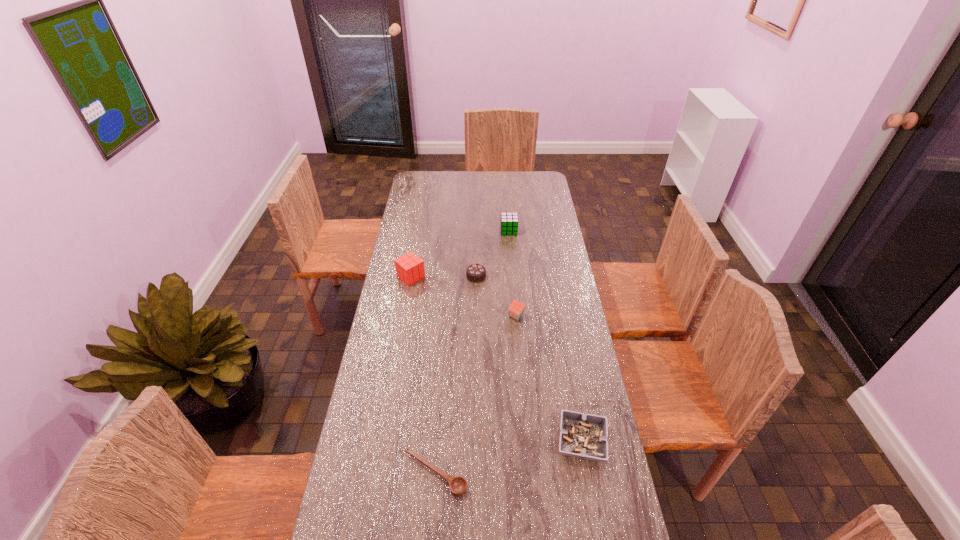
In the image, there is a desktop. Where is `vacant space at the far left corner`? The width and height of the screenshot is (960, 540). vacant space at the far left corner is located at coordinates (428, 182).

The width and height of the screenshot is (960, 540). I want to click on free space between the chocolate cake and the ashtray, so click(529, 359).

Locate an element on the screen. The width and height of the screenshot is (960, 540). empty space that is in between the farthest cube and the third nearest object is located at coordinates tap(513, 273).

Where is `free space between the farthest object and the wooden spoon`? free space between the farthest object and the wooden spoon is located at coordinates (472, 352).

The image size is (960, 540). What are the coordinates of `vacant point located between the shortest cube and the chocolate cake` in the screenshot? It's located at (496, 296).

Where is `empty space that is in between the farthest cube and the fourth farthest object`? empty space that is in between the farthest cube and the fourth farthest object is located at coordinates (513, 273).

At what (x,y) coordinates should I click in order to perform the action: click on free space between the fourth farthest object and the wooden spoon. Please return your answer as a coordinate pair (x, y). The image size is (960, 540). Looking at the image, I should click on (475, 395).

You are a GUI agent. You are given a task and a screenshot of the screen. Output one action in this format:
    pyautogui.click(x=<x>, y=<y>)
    Task: Click on the vacant space that is in between the leftmost cube and the fourth farthest object
    
    Given the screenshot: What is the action you would take?
    pyautogui.click(x=464, y=296)

Where is `blank region between the chocolate cake and the shortest object`? The image size is (960, 540). blank region between the chocolate cake and the shortest object is located at coordinates (456, 375).

In order to click on free space between the wooden spoon and the nearest cube in this screenshot , I will do `click(475, 395)`.